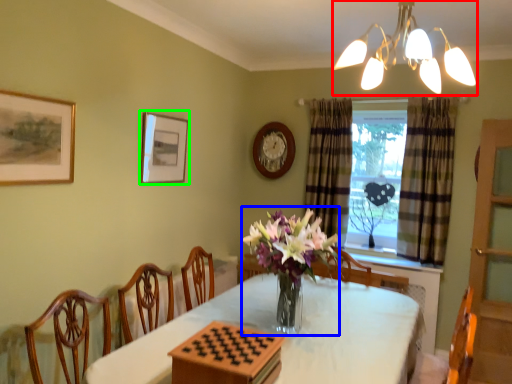
Question: Considering the real-world distances, which object is closest to lamp (highlighted by a red box)? floral arrangement (highlighted by a blue box) or picture frame (highlighted by a green box).

Choices:
 (A) floral arrangement
 (B) picture frame

Answer: (A)